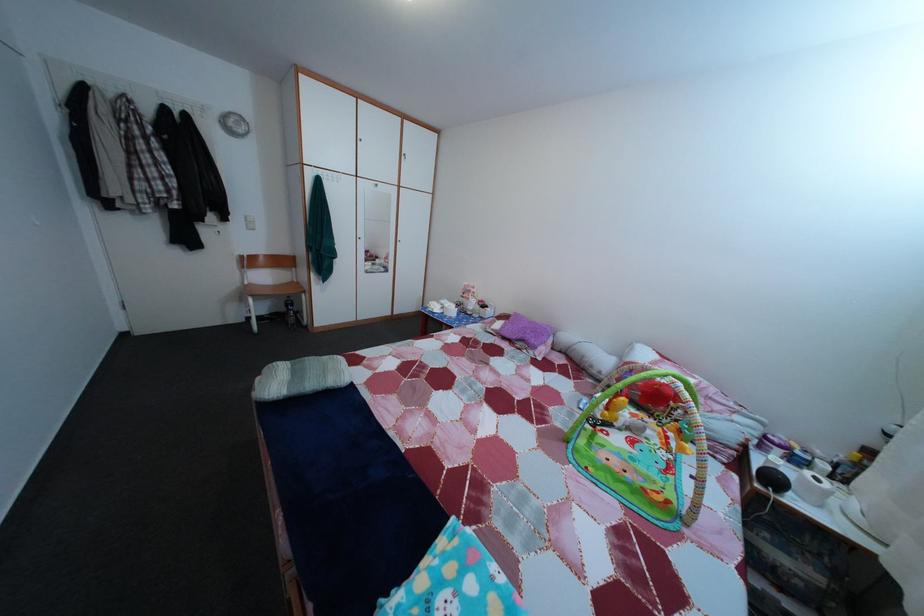
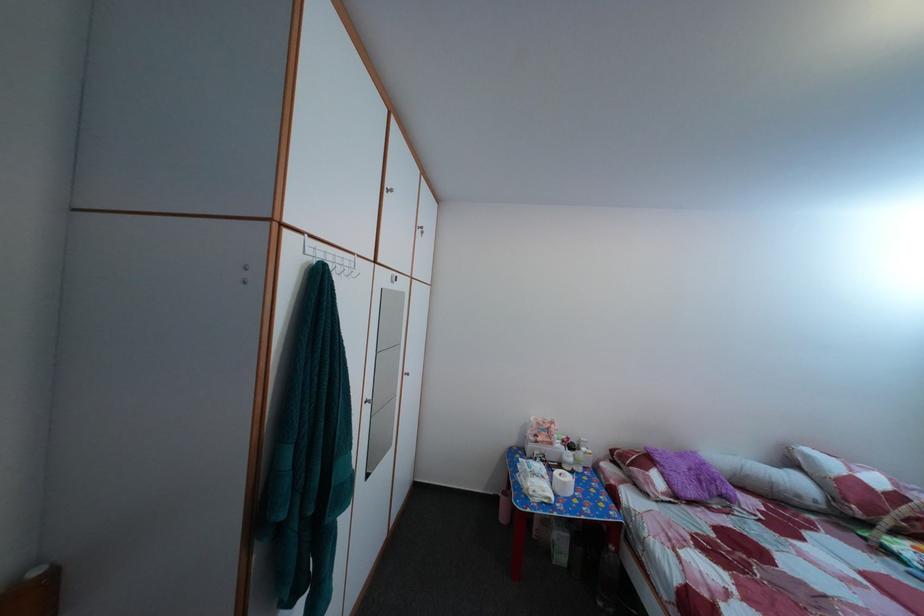
Where in the second image is the point corresponding to point (492, 309) from the first image?

(578, 447)